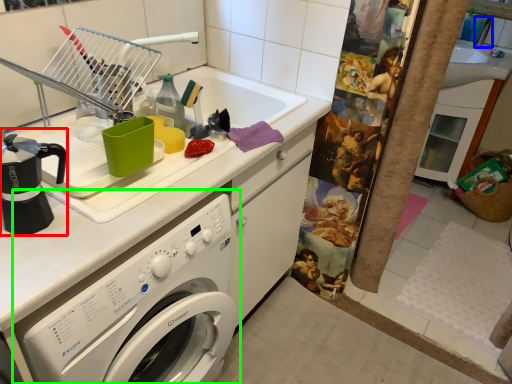
Question: Which is nearer to the coffeepot (highlighted by a red box)? faucet (highlighted by a blue box) or washing machine (highlighted by a green box).

Choices:
 (A) faucet
 (B) washing machine

Answer: (B)